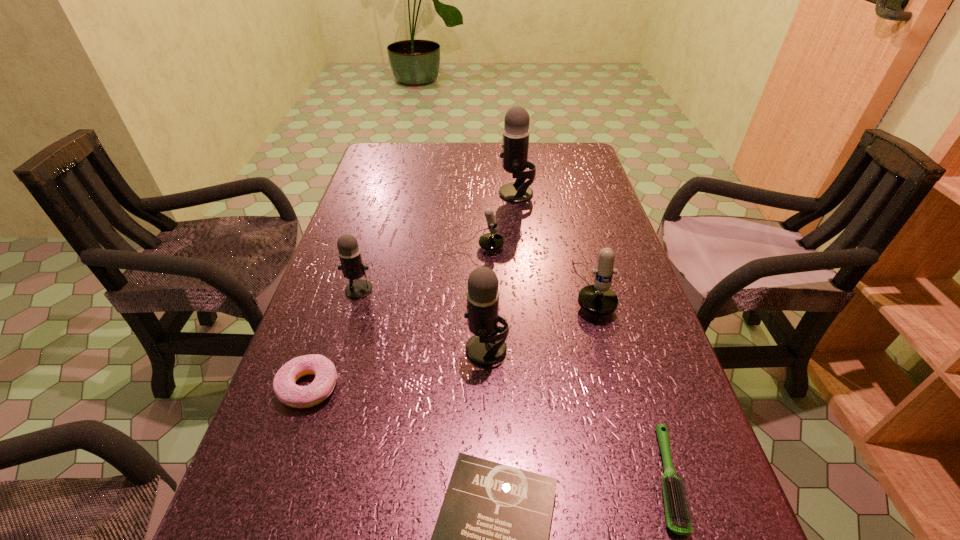
In order to click on the farthest microphone in this screenshot , I will do `click(516, 132)`.

Where is `the farthest object`? The image size is (960, 540). the farthest object is located at coordinates (516, 132).

Locate an element on the screen. The image size is (960, 540). the nearest gray microphone is located at coordinates (486, 347).

You are a GUI agent. You are given a task and a screenshot of the screen. Output one action in this format:
    pyautogui.click(x=<x>, y=<y>)
    Task: Click on the second gray microphone from left to right
    The height and width of the screenshot is (540, 960).
    Given the screenshot: What is the action you would take?
    pyautogui.click(x=486, y=347)

This screenshot has height=540, width=960. I want to click on the nearer white microphone, so click(599, 299).

This screenshot has width=960, height=540. Find the location of `the rightmost microphone`. the rightmost microphone is located at coordinates [x=599, y=299].

At what (x,y) coordinates should I click in order to perform the action: click on the second farthest gray microphone. Please return your answer as a coordinate pair (x, y). Looking at the image, I should click on (349, 252).

Locate an element on the screen. This screenshot has height=540, width=960. the smallest gray microphone is located at coordinates (349, 252).

Where is `the second farthest object`? The width and height of the screenshot is (960, 540). the second farthest object is located at coordinates (491, 241).

Locate an element on the screen. The height and width of the screenshot is (540, 960). the left white microphone is located at coordinates (491, 241).